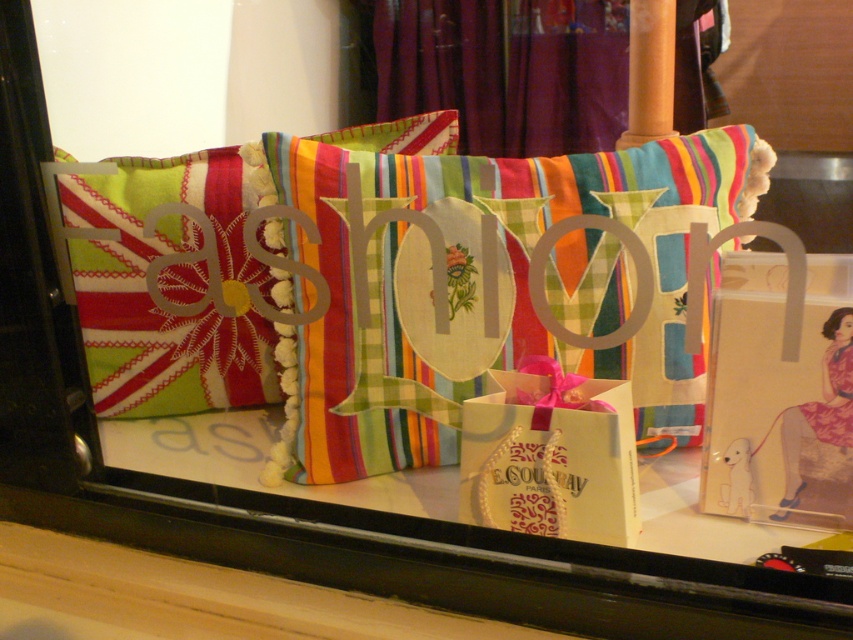
Question: In this image, where is textured fabric pillow at center located relative to white paper gift bag at center?

Choices:
 (A) right
 (B) left

Answer: (B)

Question: Which point is closer to the camera?

Choices:
 (A) striped fabric pillow at center
 (B) textured fabric pillow at center

Answer: (A)

Question: Among these objects, which one is nearest to the camera?

Choices:
 (A) striped fabric pillow at center
 (B) white paper gift bag at center
 (C) textured fabric pillow at center

Answer: (A)

Question: Estimate the real-world distances between objects in this image. Which object is closer to the textured fabric pillow at center?

Choices:
 (A) white paper gift bag at center
 (B) striped fabric pillow at center

Answer: (B)

Question: Does striped fabric pillow at center come behind textured fabric pillow at center?

Choices:
 (A) yes
 (B) no

Answer: (B)

Question: Can you confirm if striped fabric pillow at center is wider than textured fabric pillow at center?

Choices:
 (A) yes
 (B) no

Answer: (A)